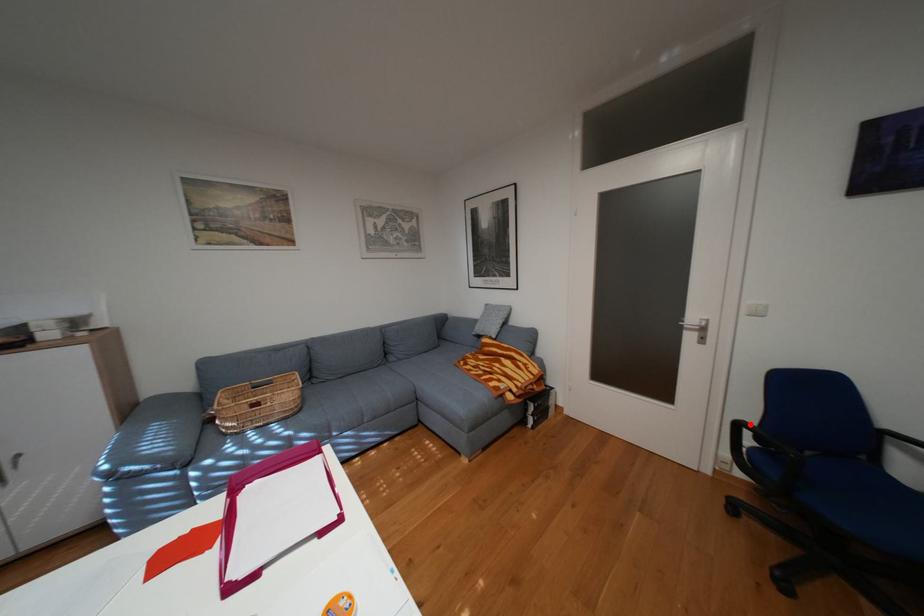
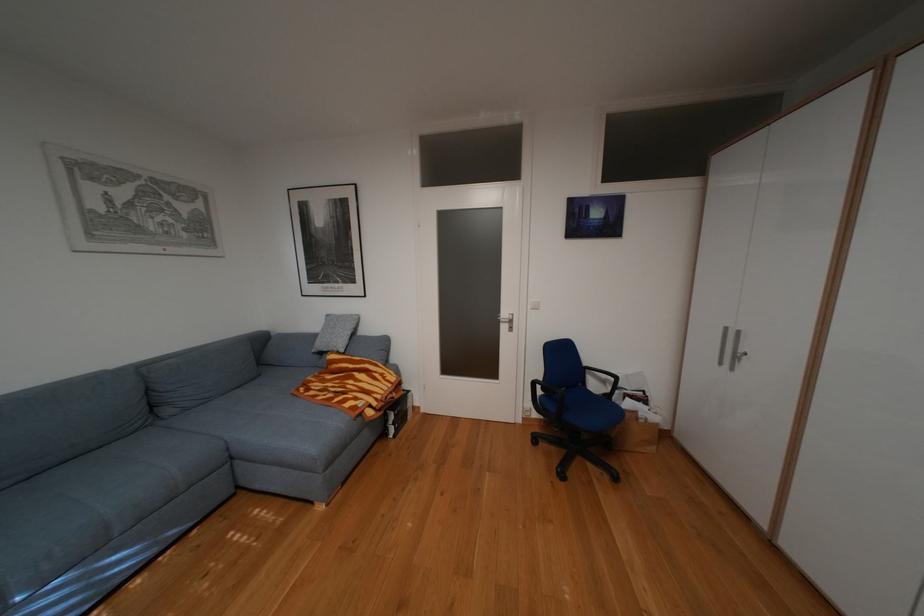
Question: I am providing you with two images of the same scene from different viewpoints. Given a red point in image1, look at the same physical point in image2. Is it:

Choices:
 (A) Closer to the viewpoint
 (B) Farther from the viewpoint

Answer: (B)